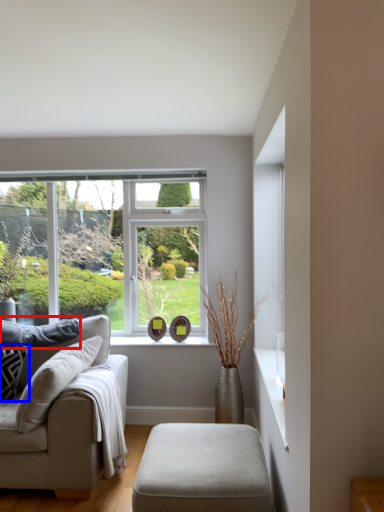
Question: Which object is closer to the camera taking this photo, pillow (highlighted by a red box) or pillow (highlighted by a blue box)?

Choices:
 (A) pillow
 (B) pillow

Answer: (B)